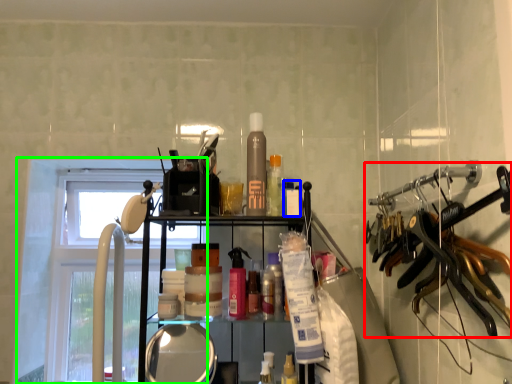
Question: Which object is the farthest from hanger (highlighted by a red box)? Choose among these: toiletry (highlighted by a blue box) or window (highlighted by a green box).

Choices:
 (A) toiletry
 (B) window

Answer: (B)